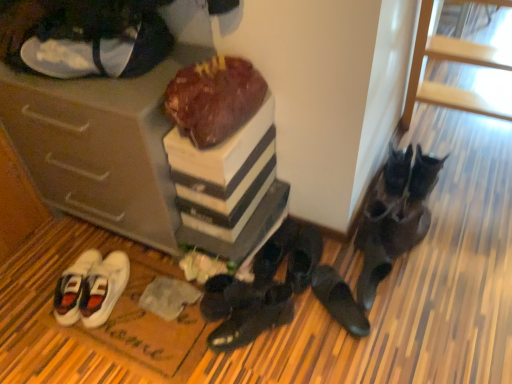
Question: Considering the positions of point (225, 102) and point (320, 264), is point (225, 102) closer or farther from the camera than point (320, 264)?

Choices:
 (A) farther
 (B) closer

Answer: (B)

Question: From a real-world perspective, is chocolate cake at center positioned above or below black leather shoes at lower right, acting as the 2th footwear starting from the right?

Choices:
 (A) above
 (B) below

Answer: (A)

Question: Which of these objects is positioned closest to the black suede shoes at lower right, the 1th footwear positioned from the right?

Choices:
 (A) black suede shoes at center, which is counted as the fifth footwear, starting from the right
 (B) white canvas sneakers at upper left, which appears as the second footwear when viewed from the left
 (C) matte brown cabinet at lower left
 (D) black leather shoes at lower right, which is the 6th footwear in left-to-right order
 (E) white canvas sneakers at lower left, the first footwear in the left-to-right sequence

Answer: (D)

Question: Which object is the closest to the black leather shoes at center, the fourth footwear in the right-to-left sequence?

Choices:
 (A) black suede shoes at lower right, which appears as the 7th footwear when viewed from the left
 (B) chocolate cake at center
 (C) black leather shoes at lower right, which is the 6th footwear in left-to-right order
 (D) white canvas sneakers at lower left, which appears as the 7th footwear when viewed from the right
 (E) white canvas sneakers at upper left, which appears as the second footwear when viewed from the left

Answer: (C)